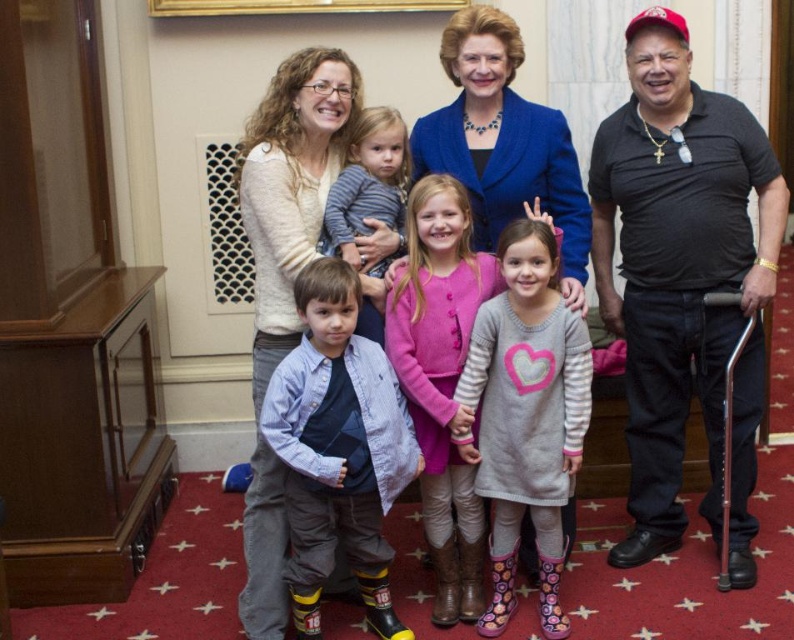
Is blue denim shirt at center wider than striped cotton shirt at center?

Yes, blue denim shirt at center is wider than striped cotton shirt at center.

Does blue denim shirt at center appear under striped cotton shirt at center?

Yes, blue denim shirt at center is below striped cotton shirt at center.

Locate an element on the screen. blue denim shirt at center is located at coordinates click(338, 449).

At what (x,y) coordinates should I click in order to perform the action: click on blue denim shirt at center. Please return your answer as a coordinate pair (x, y). The image size is (794, 640). Looking at the image, I should click on (338, 449).

Measure the distance from blue denim shirt at center to pink fleece sweater at center.

blue denim shirt at center and pink fleece sweater at center are 10.49 inches apart.

Who is taller, blue denim shirt at center or pink fleece sweater at center?

With more height is pink fleece sweater at center.

Where is `blue denim shirt at center`? Image resolution: width=794 pixels, height=640 pixels. blue denim shirt at center is located at coordinates (338, 449).

The width and height of the screenshot is (794, 640). I want to click on blue denim shirt at center, so click(338, 449).

Who is lower down, gray striped sweater at center or striped cotton shirt at center?

gray striped sweater at center is below.

The image size is (794, 640). Describe the element at coordinates (526, 417) in the screenshot. I see `gray striped sweater at center` at that location.

Where is `gray striped sweater at center`? The width and height of the screenshot is (794, 640). gray striped sweater at center is located at coordinates (526, 417).